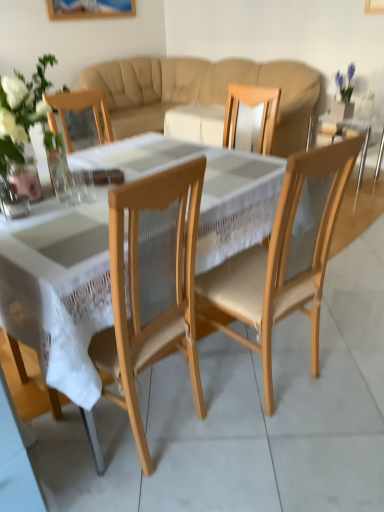
Question: Is white lace tablecloth at center facing towards transparent glass at center, which is counted as the first tableware, starting from the right?

Choices:
 (A) yes
 (B) no

Answer: (B)

Question: Is white lace tablecloth at center to the left of transparent glass at center, which is counted as the first tableware, starting from the right, from the viewer's perspective?

Choices:
 (A) no
 (B) yes

Answer: (A)

Question: From a real-world perspective, is white lace tablecloth at center on top of transparent glass at center, the 2th tableware in the left-to-right sequence?

Choices:
 (A) no
 (B) yes

Answer: (A)

Question: Can you confirm if white lace tablecloth at center is wider than transparent glass at center, which is counted as the first tableware, starting from the right?

Choices:
 (A) yes
 (B) no

Answer: (A)

Question: Is white lace tablecloth at center positioned beyond the bounds of transparent glass at center, the 2th tableware in the left-to-right sequence?

Choices:
 (A) no
 (B) yes

Answer: (B)

Question: Relative to transparent glass at center, the 2th tableware in the left-to-right sequence, is clear glass vase at left in front or behind?

Choices:
 (A) behind
 (B) front

Answer: (B)

Question: Do you think clear glass vase at left is within transparent glass at center, the 2th tableware in the left-to-right sequence, or outside of it?

Choices:
 (A) outside
 (B) inside

Answer: (A)

Question: In terms of height, does clear glass vase at left look taller or shorter compared to transparent glass at center, the 2th tableware in the left-to-right sequence?

Choices:
 (A) tall
 (B) short

Answer: (A)

Question: From the image's perspective, is clear glass vase at left located above or below transparent glass at center, which is counted as the first tableware, starting from the right?

Choices:
 (A) below
 (B) above

Answer: (B)

Question: In terms of width, does natural wood chair at center look wider or thinner when compared to white lace tablecloth at center?

Choices:
 (A) wide
 (B) thin

Answer: (B)

Question: Is natural wood chair at center in front of or behind white lace tablecloth at center in the image?

Choices:
 (A) front
 (B) behind

Answer: (B)

Question: Is natural wood chair at center to the left or to the right of white lace tablecloth at center in the image?

Choices:
 (A) right
 (B) left

Answer: (A)

Question: Is point (276, 278) positioned closer to the camera than point (89, 327)?

Choices:
 (A) closer
 (B) farther

Answer: (B)

Question: From a real-world perspective, is clear glass at center, the second tableware in the right-to-left sequence, positioned above or below natural wood chair at center?

Choices:
 (A) below
 (B) above

Answer: (B)

Question: In terms of height, does clear glass at center, the second tableware in the right-to-left sequence, look taller or shorter compared to natural wood chair at center?

Choices:
 (A) tall
 (B) short

Answer: (B)